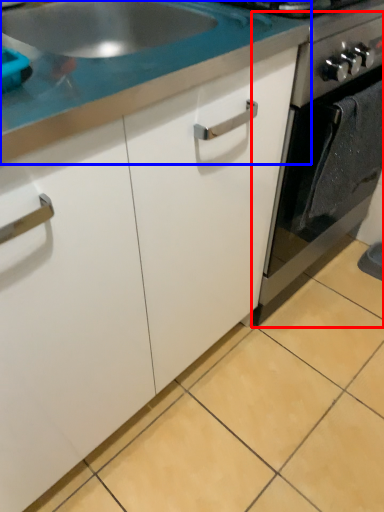
Question: Which point is closer to the camera, oven (highlighted by a red box) or countertop (highlighted by a blue box)?

Choices:
 (A) oven
 (B) countertop

Answer: (B)